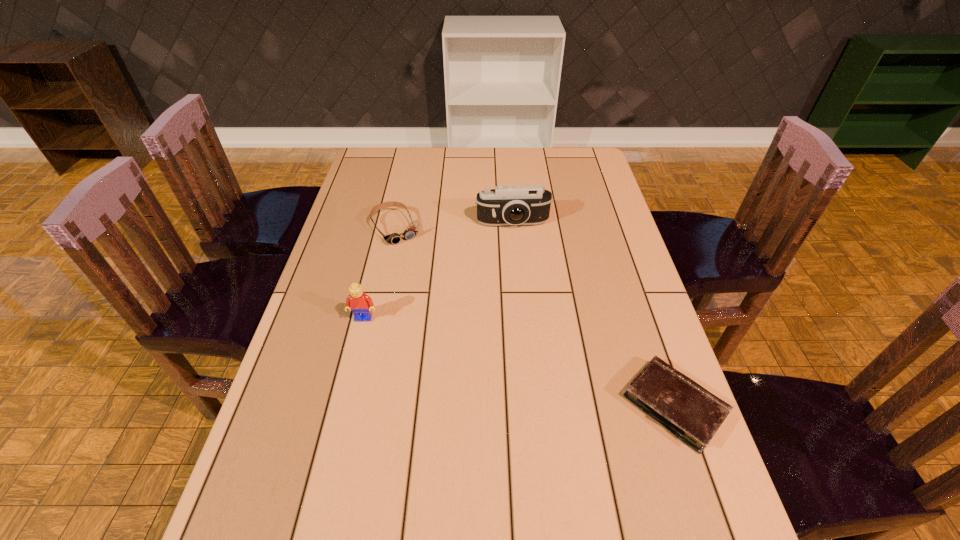
The height and width of the screenshot is (540, 960). I want to click on vacant area situated on the front lens of the third object from left to right, so click(524, 288).

Where is `free space located 0.210m on the front-facing side of the goggles`? This screenshot has height=540, width=960. free space located 0.210m on the front-facing side of the goggles is located at coordinates (434, 288).

Identify the location of free location located 0.290m on the front-facing side of the goggles. This screenshot has width=960, height=540. (446, 307).

Identify the location of vacant space situated on the front-facing side of the goggles. (436, 291).

Locate an element on the screen. Lego located at the left edge is located at coordinates (360, 304).

Identify the location of goggles at the left edge. This screenshot has height=540, width=960. (411, 231).

You are a GUI agent. You are given a task and a screenshot of the screen. Output one action in this format:
    pyautogui.click(x=<x>, y=<y>)
    Task: Click on the object at the right edge
    
    Given the screenshot: What is the action you would take?
    pyautogui.click(x=690, y=412)

In the image, there is a desktop. In order to click on vacant space at the far edge in this screenshot , I will do `click(534, 169)`.

This screenshot has height=540, width=960. In order to click on blank space at the left edge of the desktop in this screenshot , I will do `click(348, 253)`.

The height and width of the screenshot is (540, 960). In order to click on vacant space at the right edge of the desktop in this screenshot , I will do `click(627, 276)`.